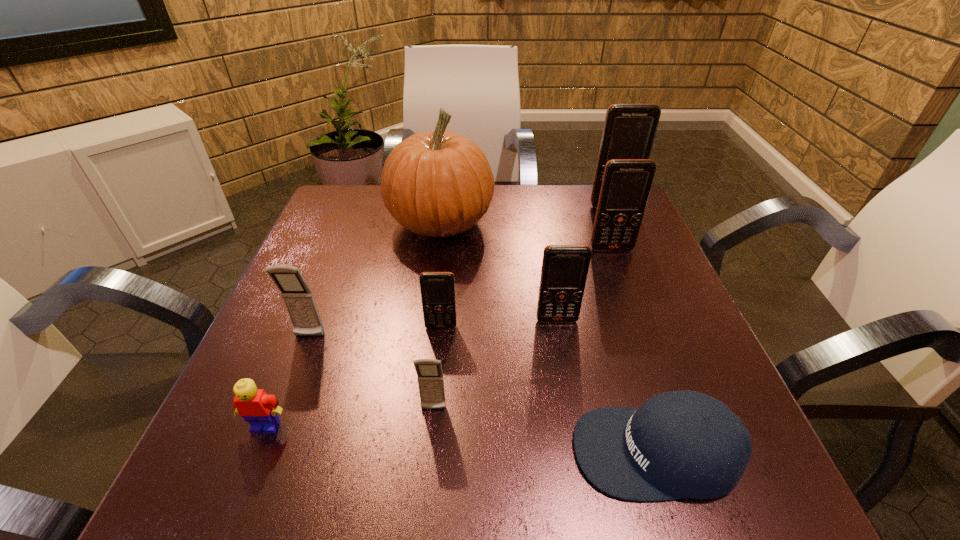
The height and width of the screenshot is (540, 960). What are the coordinates of `orange pumpkin` in the screenshot? It's located at (437, 184).

The width and height of the screenshot is (960, 540). Find the location of `the biggest orange cellular telephone`. the biggest orange cellular telephone is located at coordinates (629, 131).

Where is `the tallest cellular telephone`? The image size is (960, 540). the tallest cellular telephone is located at coordinates (629, 131).

This screenshot has width=960, height=540. I want to click on the third nearest orange cellular telephone, so click(626, 184).

At what (x,y) coordinates should I click in order to perform the action: click on the third tallest object. Please return your answer as a coordinate pair (x, y). The image size is (960, 540). Looking at the image, I should click on (626, 184).

Where is `the second nearest cellular telephone`? the second nearest cellular telephone is located at coordinates (299, 301).

Find the location of `the farther gray cellular telephone`. the farther gray cellular telephone is located at coordinates (299, 301).

At what (x,y) coordinates should I click in order to perform the action: click on the second orange cellular telephone from left to right. Please return your answer as a coordinate pair (x, y). The image size is (960, 540). Looking at the image, I should click on (564, 272).

This screenshot has width=960, height=540. Identify the location of the third cellular telephone from right to left. click(x=564, y=272).

I want to click on the leftmost orange cellular telephone, so click(437, 288).